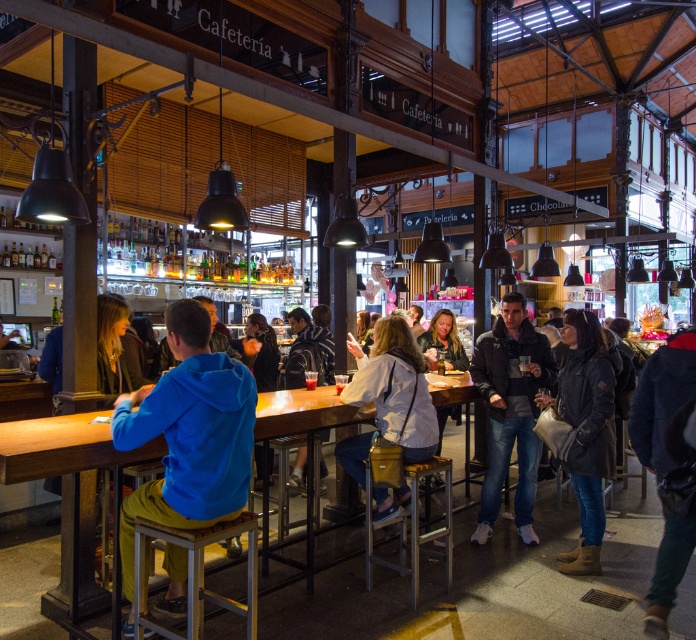
Does blue fleece jacket at center appear under leather jacket at center?

Yes.

Can you confirm if blue fleece jacket at center is taller than leather jacket at center?

Yes, blue fleece jacket at center is taller than leather jacket at center.

Where is `blue fleece jacket at center`? This screenshot has width=696, height=640. blue fleece jacket at center is located at coordinates (189, 435).

Does metallic yellow stool at lower center appear on the left side of striped sweater at center?

Yes, metallic yellow stool at lower center is to the left of striped sweater at center.

Consider the image. Is metallic yellow stool at lower center shorter than striped sweater at center?

Yes, metallic yellow stool at lower center is shorter than striped sweater at center.

Which is behind, point (213, 596) or point (299, 465)?

The point (299, 465) is behind.

Identify the location of metallic yellow stool at lower center. (197, 572).

Which of these two, denim jacket at lower right or metallic silver stool at lower center, stands taller?

denim jacket at lower right

Identify the location of denim jacket at lower right. The width and height of the screenshot is (696, 640). (661, 397).

Who is more distant from viewer, (690,548) or (445,560)?

Positioned behind is point (445,560).

You are a GUI agent. You are given a task and a screenshot of the screen. Output one action in this format:
    pyautogui.click(x=<x>, y=<y>)
    Task: Click on the denim jacket at lower right
    This screenshot has width=696, height=640.
    Given the screenshot: What is the action you would take?
    pyautogui.click(x=661, y=397)